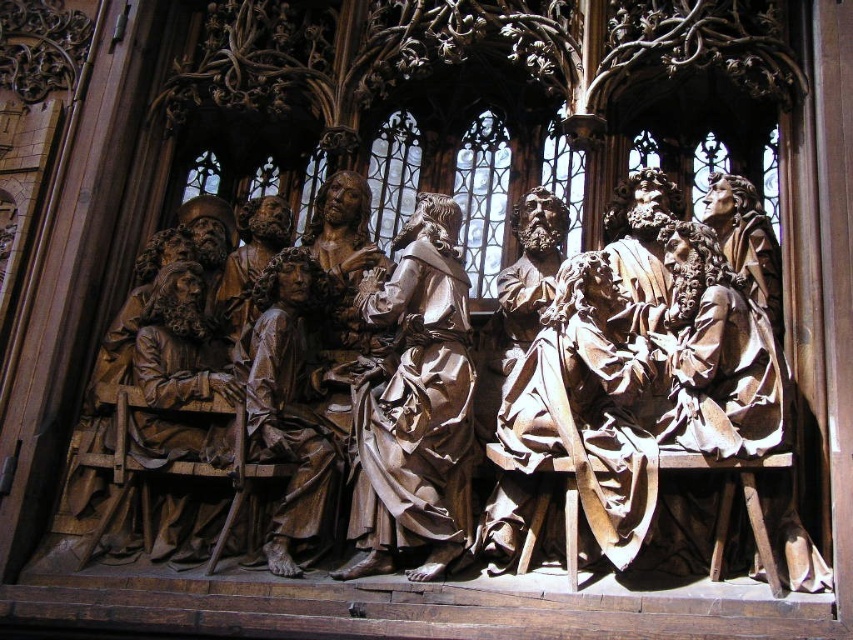
Question: Does polished wood figure at center come behind brown polished wood statue at center?

Choices:
 (A) yes
 (B) no

Answer: (A)

Question: Which point is farther to the camera?

Choices:
 (A) brown wood statue at left
 (B) brown wood carving of figures at center

Answer: (A)

Question: Which object is closer to the camera taking this photo?

Choices:
 (A) brown polished wood statue at center
 (B) brown wood statue at center
 (C) brown wood carving of figures at center
 (D) brown wood statue at left

Answer: (C)

Question: Does brown wood statue at center come behind brown wood statue at left?

Choices:
 (A) yes
 (B) no

Answer: (B)

Question: Estimate the real-world distances between objects in this image. Which object is closer to the brown wood statue at center?

Choices:
 (A) polished wood figure at center
 (B) brown polished wood statue at center
 (C) brown wood carving of figures at center

Answer: (A)

Question: Can you confirm if polished wood figure at center is thinner than brown wood statue at left?

Choices:
 (A) yes
 (B) no

Answer: (B)